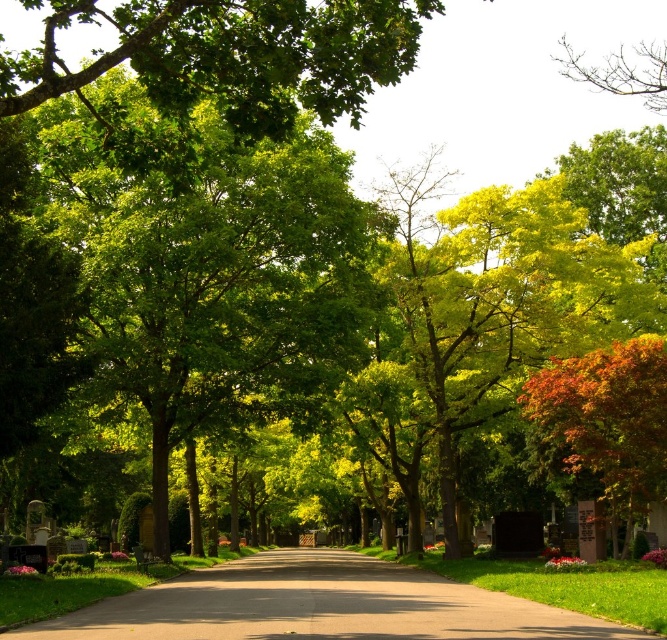
Between smooth asphalt road at center and autumnal leaves at right, which one has less height?

autumnal leaves at right

Is smooth asphalt road at center below autumnal leaves at right?

Yes.

The image size is (667, 640). What do you see at coordinates (317, 605) in the screenshot?
I see `smooth asphalt road at center` at bounding box center [317, 605].

What are the coordinates of `smooth asphalt road at center` in the screenshot? It's located at pos(317,605).

Which of these two, green leafy tree at center or smooth asphalt road at center, stands shorter?

Standing shorter between the two is smooth asphalt road at center.

Does point (135, 131) come behind point (327, 614)?

No, (135, 131) is closer to viewer.

The height and width of the screenshot is (640, 667). In order to click on green leafy tree at center in this screenshot , I will do `click(203, 262)`.

Between point (63, 232) and point (592, 433), which one is positioned behind?

Positioned behind is point (63, 232).

Is green leafy tree at center positioned in front of autumnal leaves at right?

Yes, green leafy tree at center is closer to the viewer.

Image resolution: width=667 pixels, height=640 pixels. Identify the location of green leafy tree at center. (203, 262).